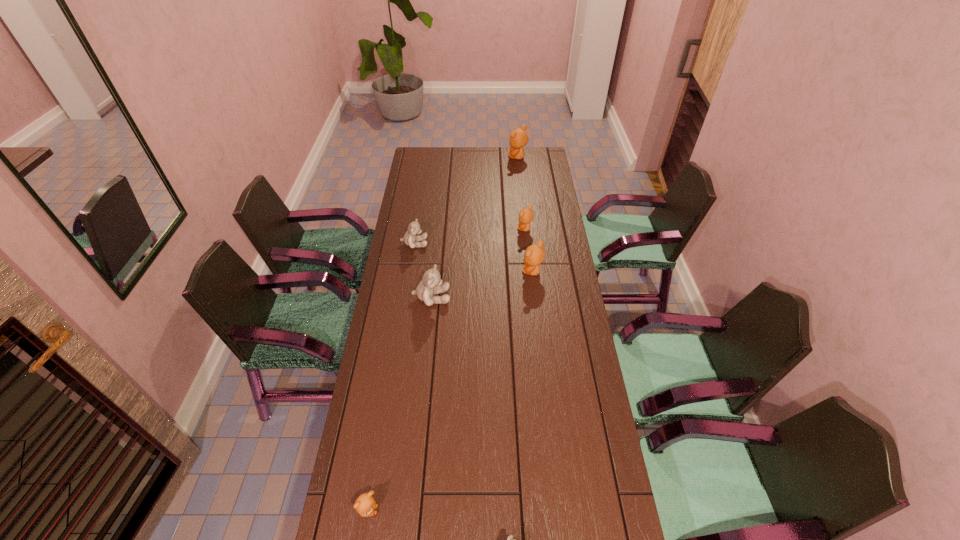
This screenshot has height=540, width=960. I want to click on free space located 0.250m on the face of the second farthest teddy bear, so click(x=463, y=229).

Locate an element on the screen. The width and height of the screenshot is (960, 540). free space located on the face of the second farthest teddy bear is located at coordinates (493, 229).

Identify the location of vacant region located 0.060m on the face of the fifth nearest teddy bear. The width and height of the screenshot is (960, 540). (442, 244).

Find the location of a particular element. vacant space located on the face of the leftmost brown teddy bear is located at coordinates (490, 510).

I want to click on object that is at the far edge, so click(x=518, y=138).

I want to click on object positioned at the far right corner, so coord(518,138).

In order to click on vacant space at the far edge of the desktop in this screenshot , I will do `click(456, 148)`.

In the image, there is a desktop. Identify the location of free space at the left edge. Image resolution: width=960 pixels, height=540 pixels. (399, 285).

Identify the location of vacant region at the right edge of the desktop. The height and width of the screenshot is (540, 960). (595, 517).

The image size is (960, 540). I want to click on vacant space at the far left corner, so click(x=421, y=154).